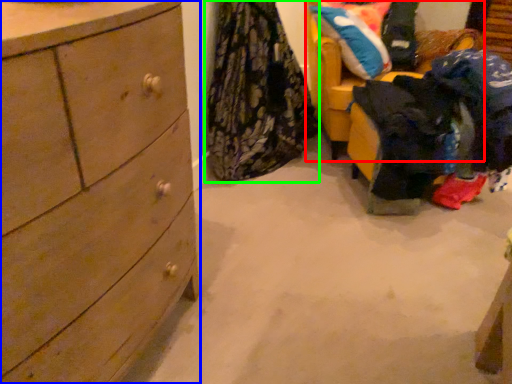
Question: Estimate the real-world distances between objects in this image. Which object is closer to furniture (highlighted by a red box), chest of drawers (highlighted by a blue box) or clothing (highlighted by a green box)?

Choices:
 (A) chest of drawers
 (B) clothing

Answer: (B)